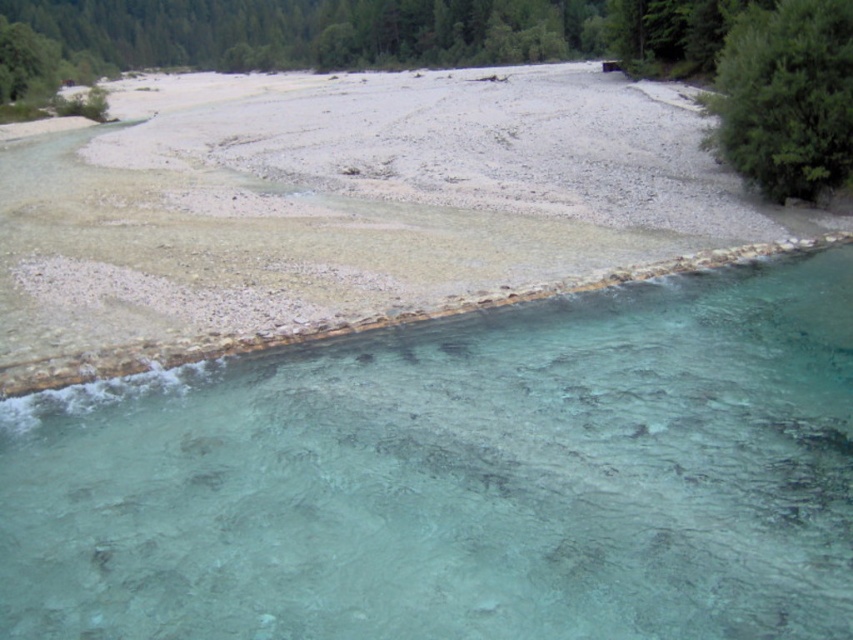
Is point (608, 492) positioned behind point (109, 42)?

No.

Find the location of `clear glassy water at lower center`. clear glassy water at lower center is located at coordinates (460, 477).

This screenshot has width=853, height=640. Find the location of `clear glassy water at lower center`. clear glassy water at lower center is located at coordinates [460, 477].

Does green leafy tree at upper center have a greater width compared to green leafy tree at upper right?

Correct, the width of green leafy tree at upper center exceeds that of green leafy tree at upper right.

Which is in front, point (613, 44) or point (764, 193)?

Point (764, 193) is in front.

Does point (521, 28) lie behind point (788, 93)?

Yes.

Where is `green leafy tree at upper center`? The width and height of the screenshot is (853, 640). green leafy tree at upper center is located at coordinates (386, 32).

Describe the element at coordinates (460, 477) in the screenshot. This screenshot has width=853, height=640. I see `clear glassy water at lower center` at that location.

Does clear glassy water at lower center appear on the left side of green leafy tree at upper right?

Correct, you'll find clear glassy water at lower center to the left of green leafy tree at upper right.

The height and width of the screenshot is (640, 853). I want to click on clear glassy water at lower center, so click(x=460, y=477).